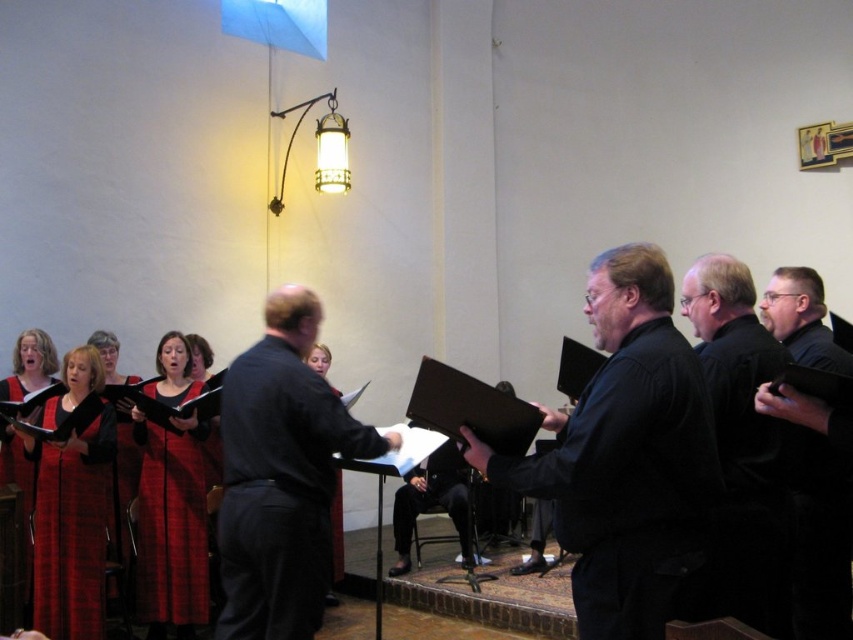
What do you see at coordinates (73, 531) in the screenshot?
I see `plaid wool dress at lower left` at bounding box center [73, 531].

Is plaid wool dress at lower left shorter than red plaid dress at center?

Indeed, plaid wool dress at lower left has a lesser height compared to red plaid dress at center.

What do you see at coordinates (73, 531) in the screenshot?
I see `plaid wool dress at lower left` at bounding box center [73, 531].

The height and width of the screenshot is (640, 853). What are the coordinates of `plaid wool dress at lower left` in the screenshot? It's located at (73, 531).

Locate an element on the screen. dark blue shirt at center is located at coordinates (281, 476).

Looking at this image, who is shorter, dark blue shirt at center or plaid wool dress at lower left?

Standing shorter between the two is plaid wool dress at lower left.

In the scene shown: Who is more forward, (297, 470) or (85, 602)?

Point (297, 470)

You are a GUI agent. You are given a task and a screenshot of the screen. Output one action in this format:
    pyautogui.click(x=<x>, y=<y>)
    Task: Click on the dark blue shirt at center
    The image size is (853, 640).
    Given the screenshot: What is the action you would take?
    pyautogui.click(x=281, y=476)

Can you confirm if black matte suit at right is taller than red plaid dress at center?

Incorrect, black matte suit at right's height is not larger of red plaid dress at center's.

You are a GUI agent. You are given a task and a screenshot of the screen. Output one action in this format:
    pyautogui.click(x=<x>, y=<y>)
    Task: Click on the black matte suit at right
    The image size is (853, 640).
    Given the screenshot: What is the action you would take?
    pyautogui.click(x=741, y=444)